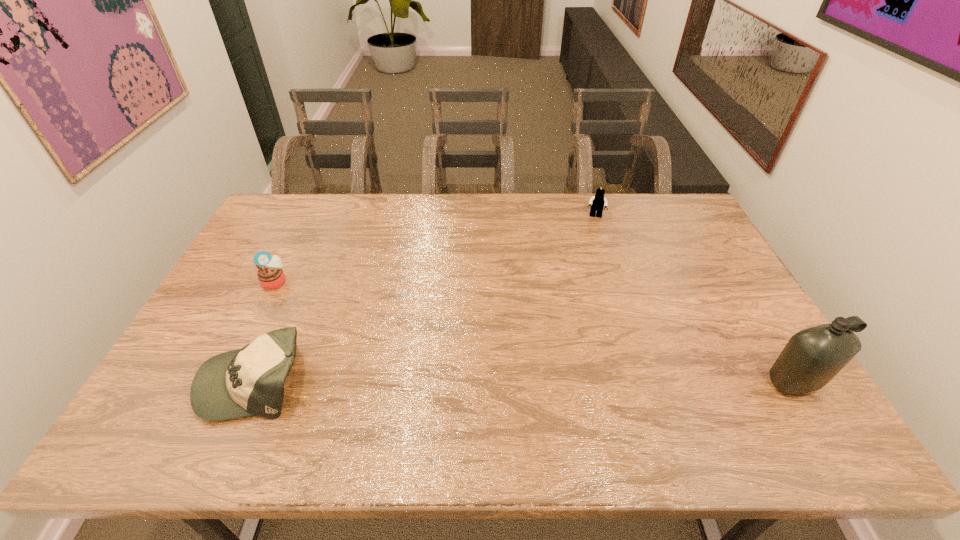
Locate an element on the screen. This screenshot has height=540, width=960. free region located on the front-facing side of the muffin is located at coordinates (360, 332).

In order to click on vacant space located 0.220m on the front-facing side of the farthest object in this screenshot , I will do `click(592, 260)`.

At what (x,y) coordinates should I click in order to perform the action: click on vacant space situated on the front-facing side of the farthest object. Please return your answer as a coordinate pair (x, y). Image resolution: width=960 pixels, height=540 pixels. Looking at the image, I should click on (590, 279).

Where is `free space located 0.210m on the front-facing side of the farthest object`? free space located 0.210m on the front-facing side of the farthest object is located at coordinates (592, 258).

The image size is (960, 540). Find the location of `object that is at the far edge`. object that is at the far edge is located at coordinates (597, 202).

The height and width of the screenshot is (540, 960). Find the location of `baseball cap that is at the near edge`. baseball cap that is at the near edge is located at coordinates (244, 382).

Where is `bottle that is at the near edge`? This screenshot has width=960, height=540. bottle that is at the near edge is located at coordinates (812, 357).

This screenshot has height=540, width=960. What are the coordinates of `baseball cap that is at the left edge` in the screenshot? It's located at (244, 382).

You are a GUI agent. You are given a task and a screenshot of the screen. Output one action in this format:
    pyautogui.click(x=<x>, y=<y>)
    Task: Click on the muffin positioned at the left edge
    This screenshot has width=960, height=540.
    Given the screenshot: What is the action you would take?
    pyautogui.click(x=270, y=274)

Find the location of `object that is at the right edge`. object that is at the right edge is located at coordinates (812, 357).